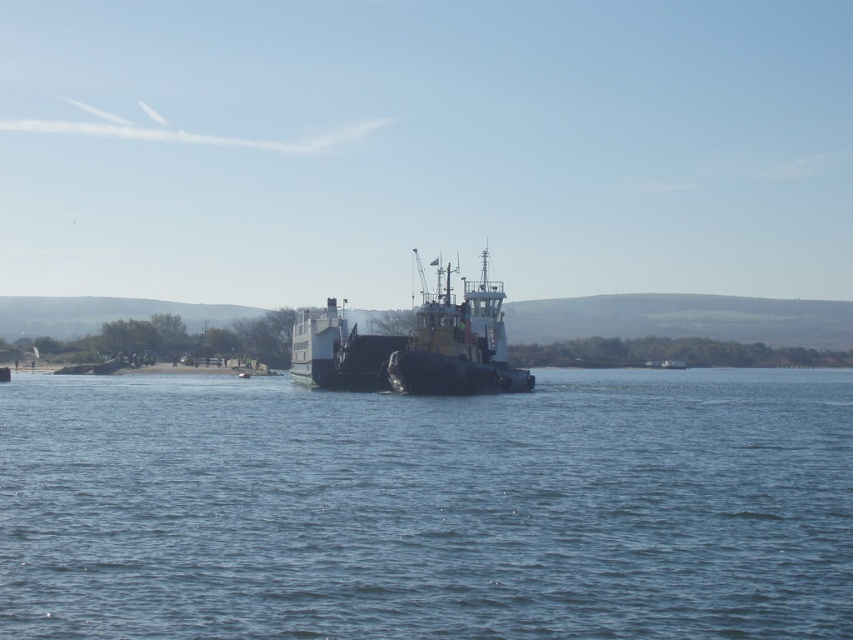
Between blue water at center and black matte tugboat at center, which one is positioned lower?

blue water at center is lower down.

Can you confirm if blue water at center is positioned to the right of black matte tugboat at center?

In fact, blue water at center is to the left of black matte tugboat at center.

Between point (267, 561) and point (502, 284), which one is positioned behind?

Positioned behind is point (502, 284).

Where is `blue water at center`? This screenshot has width=853, height=640. blue water at center is located at coordinates (428, 508).